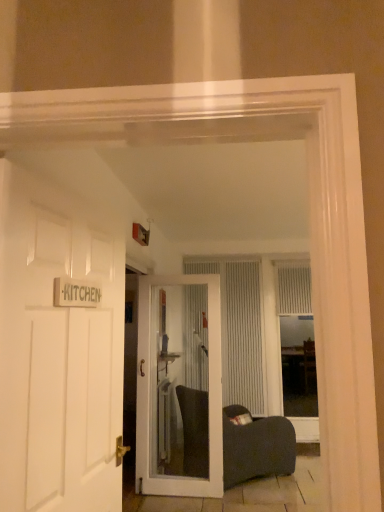
Question: From a real-world perspective, is white textured curtain at center, the second curtain from the right, physically located above or below white textured curtain at center, acting as the first curtain starting from the right?

Choices:
 (A) above
 (B) below

Answer: (B)

Question: Looking at their shapes, would you say white textured curtain at center, which appears as the 1th curtain when viewed from the left, is wider or thinner than white textured curtain at center, acting as the first curtain starting from the right?

Choices:
 (A) wide
 (B) thin

Answer: (B)

Question: Estimate the real-world distances between objects in this image. Which object is closer to the clear glass door at center, positioned as the second door in front-to-back order?

Choices:
 (A) white textured curtain at center, which appears as the 1th curtain when viewed from the left
 (B) white textured curtain at center, which ranks as the second curtain in left-to-right order
 (C) white textured blinds at center
 (D) white wooden door at left, the first door viewed from the front

Answer: (A)

Question: Which object is the farthest from the clear glass door at center, positioned as the second door in front-to-back order?

Choices:
 (A) white wooden door at left, the first door viewed from the front
 (B) white textured blinds at center
 (C) white textured curtain at center, which ranks as the second curtain in left-to-right order
 (D) white textured curtain at center, the second curtain from the right

Answer: (A)